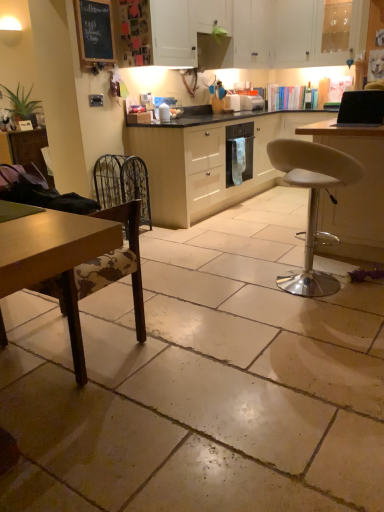
Question: Based on their sizes in the image, would you say black glossy laptop at upper right is bigger or smaller than wooden chair at lower left, which is counted as the 1th chair, starting from the left?

Choices:
 (A) big
 (B) small

Answer: (B)

Question: From the image's perspective, is black glossy laptop at upper right located above or below wooden chair at lower left, which is counted as the 1th chair, starting from the left?

Choices:
 (A) below
 (B) above

Answer: (B)

Question: Which is farther from the white glossy cabinet at upper center, the 3th cabinetry ordered from the bottom?

Choices:
 (A) white leather stool at center-right, which is the first chair from right to left
 (B) metallic wire swivel chair at left
 (C) wooden chair at lower left, placed as the second chair when sorted from right to left
 (D) white plastic toaster at center, the 2th appliance from the back
 (E) black chalkboard at upper left

Answer: (C)

Question: Which is nearer to the wooden chair at lower left, placed as the second chair when sorted from right to left?

Choices:
 (A) black glossy laptop at upper right
 (B) black chalkboard at upper left
 (C) cream matte cabinet at center, acting as the 3th cabinetry starting from the top
 (D) metallic oven at center, arranged as the 1th appliance when viewed from the back
 (E) white glossy cabinet at upper center, which ranks as the 1th cabinetry in top-to-bottom order

Answer: (A)